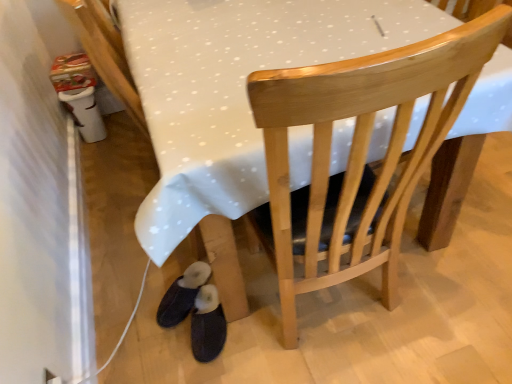
What are the coordinates of `vacant area located to the right-hand side of black suede slippers at lower left, which appears as the 2th footwear when viewed from the right` in the screenshot? It's located at (253, 294).